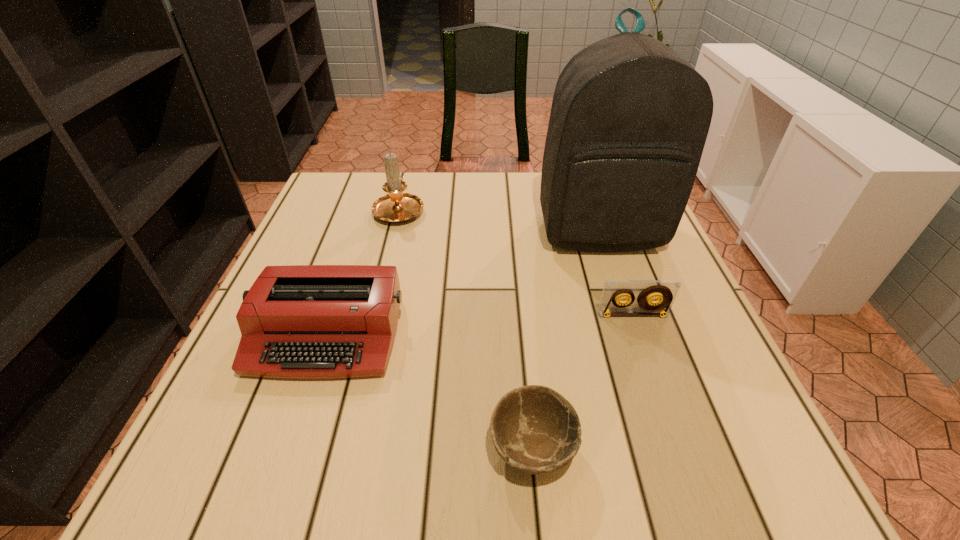
Where is `free space located 0.050m on the left of the third object from right to left`? This screenshot has height=540, width=960. free space located 0.050m on the left of the third object from right to left is located at coordinates (457, 448).

At what (x,y) coordinates should I click in order to perform the action: click on backpack situated at the far edge. Please return your answer as a coordinate pair (x, y). The image size is (960, 540). Looking at the image, I should click on (629, 119).

Locate an element on the screen. The image size is (960, 540). candle present at the far edge is located at coordinates (396, 206).

Identify the location of object at the near edge. This screenshot has width=960, height=540. (534, 429).

Locate an element on the screen. This screenshot has width=960, height=540. candle that is at the left edge is located at coordinates (396, 206).

Image resolution: width=960 pixels, height=540 pixels. What are the coordinates of `typewriter that is at the left edge` in the screenshot? It's located at point(297,321).

The height and width of the screenshot is (540, 960). In order to click on backpack that is at the right edge in this screenshot , I will do `click(629, 119)`.

At what (x,y) coordinates should I click in order to perform the action: click on videotape located in the right edge section of the desktop. Please return your answer as a coordinate pair (x, y). Looking at the image, I should click on (665, 291).

Where is `object at the far left corner`? This screenshot has height=540, width=960. object at the far left corner is located at coordinates (396, 206).

The width and height of the screenshot is (960, 540). What are the coordinates of `object at the far right corner` in the screenshot? It's located at (629, 119).